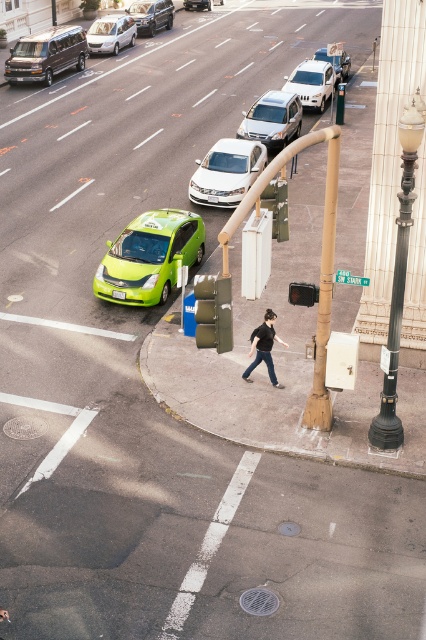
Is point (319, 305) positioned in front of point (227, 164)?

Yes, point (319, 305) is closer to viewer.

Between wooden pole at center and satin silver sedan at center, which one is positioned lower?

wooden pole at center

The width and height of the screenshot is (426, 640). What are the coordinates of `wooden pole at center` in the screenshot? It's located at (324, 289).

Which of these two, matte brown van at upper left or black cotton shirt at center, stands taller?

Standing taller between the two is black cotton shirt at center.

The width and height of the screenshot is (426, 640). Identify the location of matte brown van at upper left. (46, 54).

Does point (8, 67) lie behind point (258, 342)?

That is True.

Identify the location of matte brown van at upper left. (46, 54).

Is matte silver minivan at upper left wider than metallic silver sedan at center?

Correct, the width of matte silver minivan at upper left exceeds that of metallic silver sedan at center.

Who is more forward, (x=94, y=44) or (x=342, y=68)?

Point (x=342, y=68)

Locate an element on the screen. The width and height of the screenshot is (426, 640). matte silver minivan at upper left is located at coordinates (111, 33).